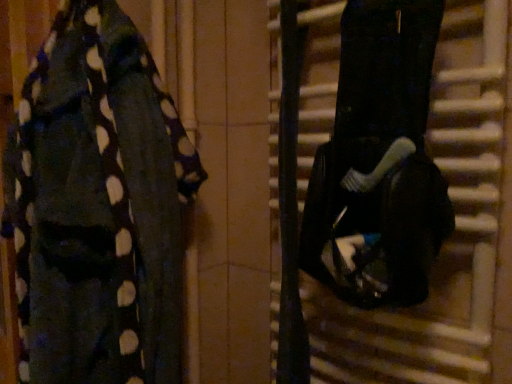
Question: In the image, is polka dot fabric at left on the left side or the right side of black matte guitar case at right?

Choices:
 (A) right
 (B) left

Answer: (B)

Question: Do you think polka dot fabric at left is within black matte guitar case at right, or outside of it?

Choices:
 (A) outside
 (B) inside

Answer: (A)

Question: In terms of size, does polka dot fabric at left appear bigger or smaller than black matte guitar case at right?

Choices:
 (A) small
 (B) big

Answer: (B)

Question: From the image's perspective, is black matte guitar case at right located above or below polka dot fabric at left?

Choices:
 (A) above
 (B) below

Answer: (A)

Question: From a real-world perspective, is black matte guitar case at right positioned above or below polka dot fabric at left?

Choices:
 (A) above
 (B) below

Answer: (A)

Question: Is black matte guitar case at right in front of or behind polka dot fabric at left in the image?

Choices:
 (A) front
 (B) behind

Answer: (B)

Question: Is black matte guitar case at right inside or outside of polka dot fabric at left?

Choices:
 (A) outside
 (B) inside

Answer: (A)